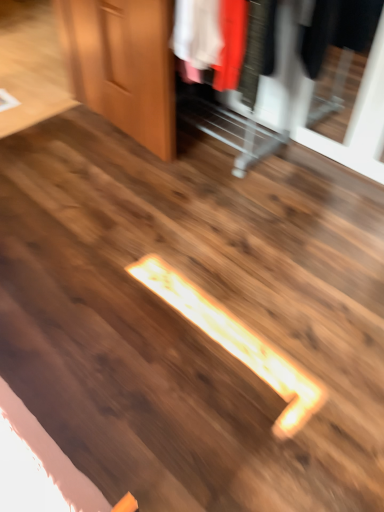
Question: From the image's perspective, is wooden dresser at upper right located above wooden door at upper left?

Choices:
 (A) yes
 (B) no

Answer: (B)

Question: Can you confirm if wooden dresser at upper right is smaller than wooden door at upper left?

Choices:
 (A) yes
 (B) no

Answer: (B)

Question: Is wooden dresser at upper right shorter than wooden door at upper left?

Choices:
 (A) no
 (B) yes

Answer: (A)

Question: Would you say wooden door at upper left is part of wooden dresser at upper right's contents?

Choices:
 (A) no
 (B) yes

Answer: (A)

Question: Is wooden dresser at upper right looking in the opposite direction of wooden door at upper left?

Choices:
 (A) no
 (B) yes

Answer: (A)

Question: Is wooden dresser at upper right at the right side of wooden door at upper left?

Choices:
 (A) yes
 (B) no

Answer: (A)

Question: Is wooden door at upper left at the right side of wooden dresser at upper right?

Choices:
 (A) yes
 (B) no

Answer: (B)

Question: Can you confirm if wooden door at upper left is bigger than wooden dresser at upper right?

Choices:
 (A) no
 (B) yes

Answer: (A)

Question: Is wooden dresser at upper right at the back of wooden door at upper left?

Choices:
 (A) no
 (B) yes

Answer: (B)

Question: Can wooden dresser at upper right be found inside wooden door at upper left?

Choices:
 (A) yes
 (B) no

Answer: (B)

Question: Considering the relative sizes of wooden door at upper left and wooden dresser at upper right in the image provided, is wooden door at upper left smaller than wooden dresser at upper right?

Choices:
 (A) yes
 (B) no

Answer: (A)

Question: From a real-world perspective, is wooden door at upper left located higher than wooden dresser at upper right?

Choices:
 (A) yes
 (B) no

Answer: (B)

Question: From their relative heights in the image, would you say wooden dresser at upper right is taller or shorter than wooden door at upper left?

Choices:
 (A) tall
 (B) short

Answer: (A)